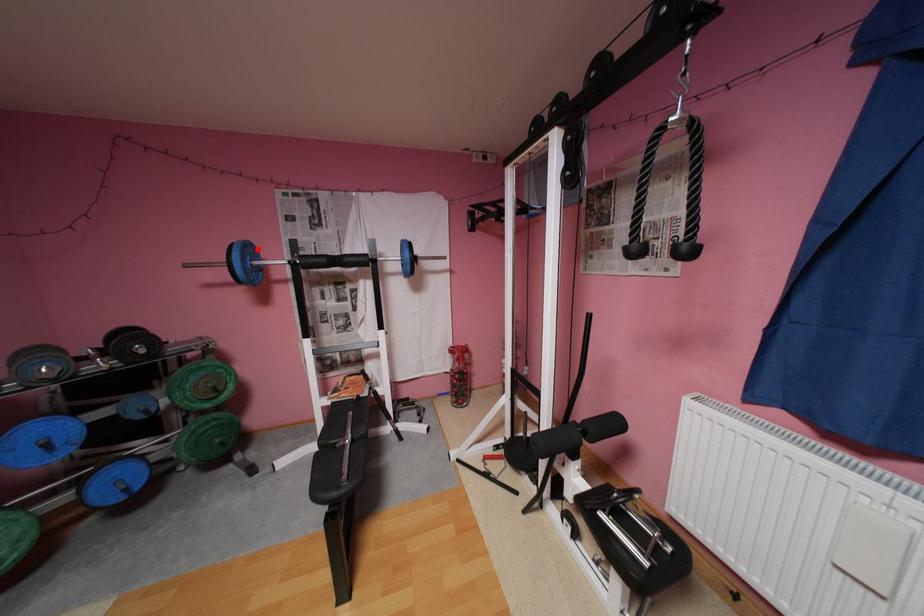
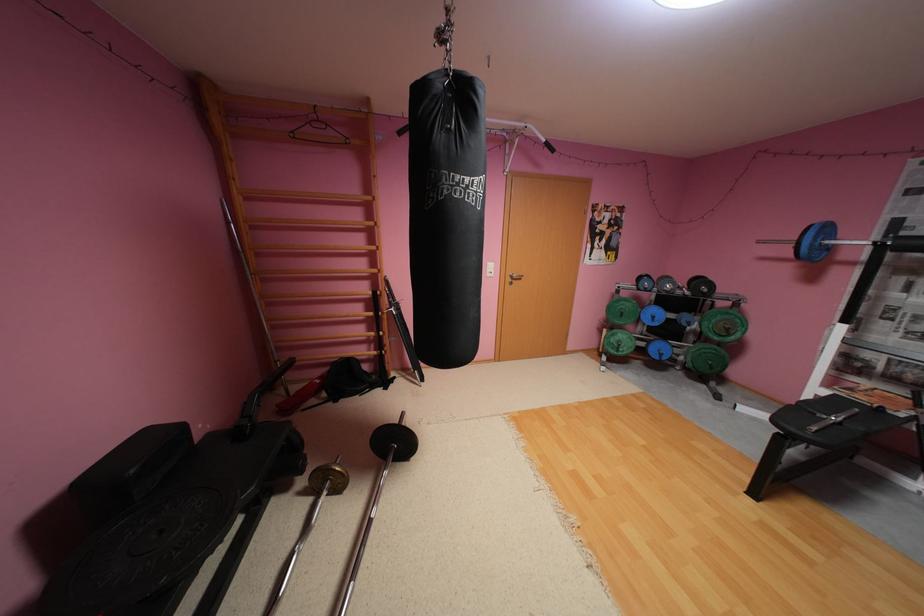
Locate, in the second image, the point that corresponds to the highlighted location in the first image.

(835, 229)